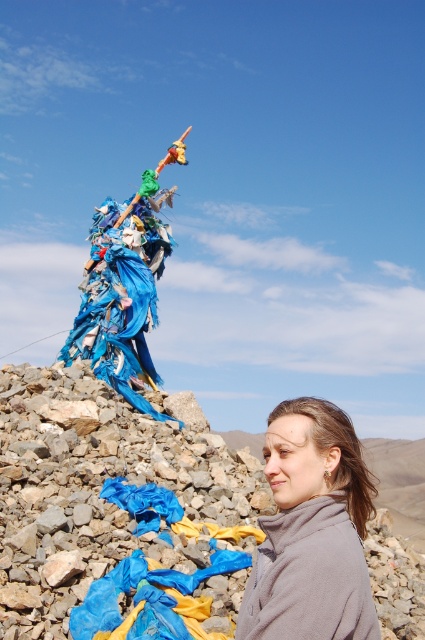
Locate an element on the screen. Image resolution: width=425 pixels, height=640 pixels. blue fabric at lower left is located at coordinates (110, 500).

Which is in front, point (241, 474) or point (269, 516)?

Point (269, 516) is more forward.

Image resolution: width=425 pixels, height=640 pixels. Identify the location of blue fabric at lower left. (110, 500).